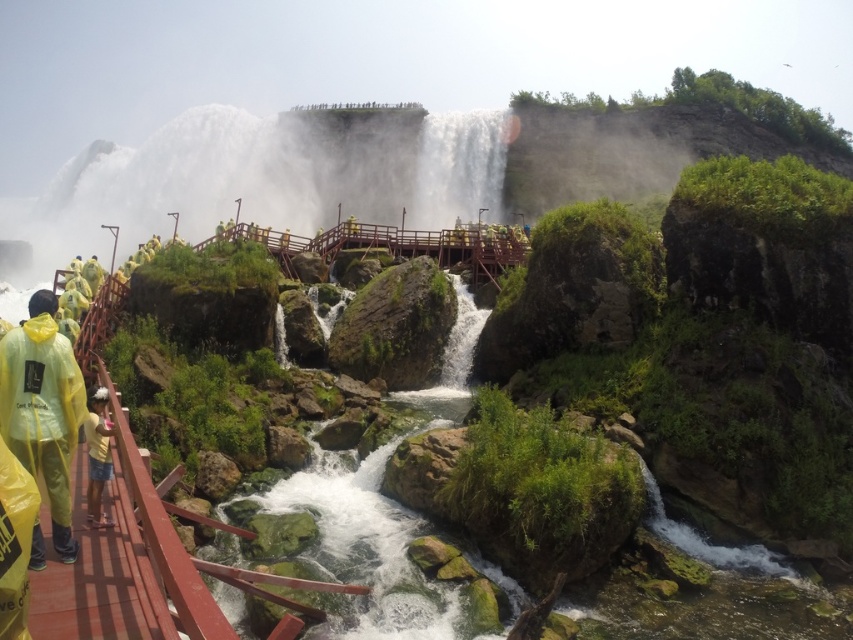
Between yellow translucent raincoat at lower left and yellow matte shorts at lower left, which one appears on the left side from the viewer's perspective?

From the viewer's perspective, yellow translucent raincoat at lower left appears more on the left side.

Is the position of yellow translucent raincoat at lower left less distant than that of yellow matte shorts at lower left?

That is True.

Who is more distant from viewer, (67, 470) or (96, 416)?

Point (96, 416)

At what (x,y) coordinates should I click in order to perform the action: click on yellow translucent raincoat at lower left. Please return your answer as a coordinate pair (x, y). The height and width of the screenshot is (640, 853). Looking at the image, I should click on pos(44,408).